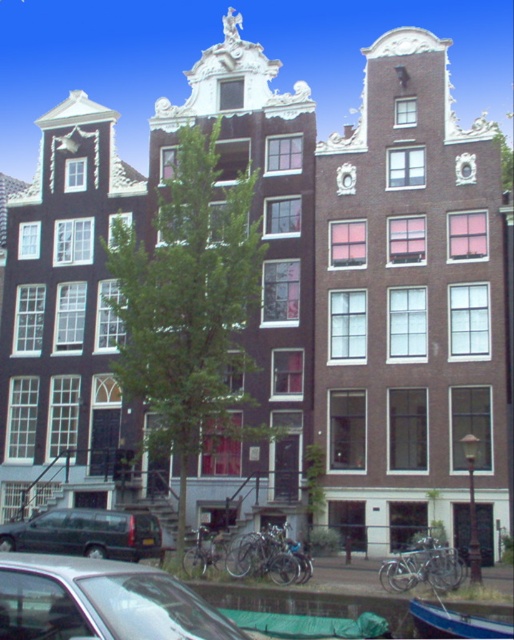
You are a tourist standing in front of the row of Dutch buildings. You see a silver metallic bicycle at center and a blue painted wood boat at lower right. Which object is positioned closer to the left side of the scene?

The silver metallic bicycle at center is positioned to the left of the blue painted wood boat at lower right, so it is closer to the left side of the scene.

You are a photographer planning to capture a photo of the Dutch buildings. You have a silver metallic bicycle at center and a shiny silver car at lower left in your frame. Which object will appear taller in the photo?

The shiny silver car at lower left will appear taller in the photo because it is taller than the silver metallic bicycle at center according to the description.

You are standing in front of the Dutch buildings and see a shiny silver car at lower left and a silver metallic bicycle at center. Which one is positioned more to the left?

The shiny silver car at lower left is positioned more to the left than the silver metallic bicycle at center.